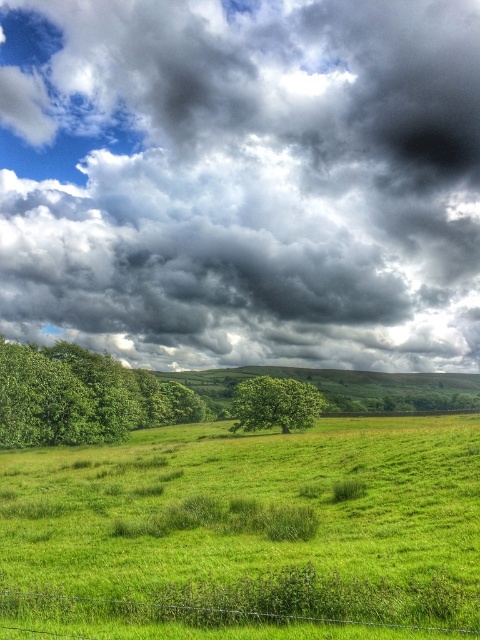
Is green leafy tree at center shorter than wire mesh fence at lower center?

In fact, green leafy tree at center may be taller than wire mesh fence at lower center.

Between green leafy tree at center and wire mesh fence at lower center, which one has more height?

green leafy tree at center is taller.

Locate an element on the screen. The height and width of the screenshot is (640, 480). green leafy tree at center is located at coordinates (275, 404).

Image resolution: width=480 pixels, height=640 pixels. I want to click on green leafy tree at center, so click(x=275, y=404).

Where is `green leafy tree at left`? The image size is (480, 640). green leafy tree at left is located at coordinates (82, 396).

From the picture: Who is more distant from viewer, [127,385] or [88,600]?

The point [127,385] is more distant.

Describe the element at coordinates (82, 396) in the screenshot. I see `green leafy tree at left` at that location.

I want to click on green leafy tree at left, so click(x=82, y=396).

Can you confirm if cloudy sky at upper center is positioned to the right of wire mesh fence at lower center?

Indeed, cloudy sky at upper center is positioned on the right side of wire mesh fence at lower center.

Which is above, cloudy sky at upper center or wire mesh fence at lower center?

cloudy sky at upper center is higher up.

Where is `cloudy sky at upper center`? The height and width of the screenshot is (640, 480). cloudy sky at upper center is located at coordinates (242, 180).